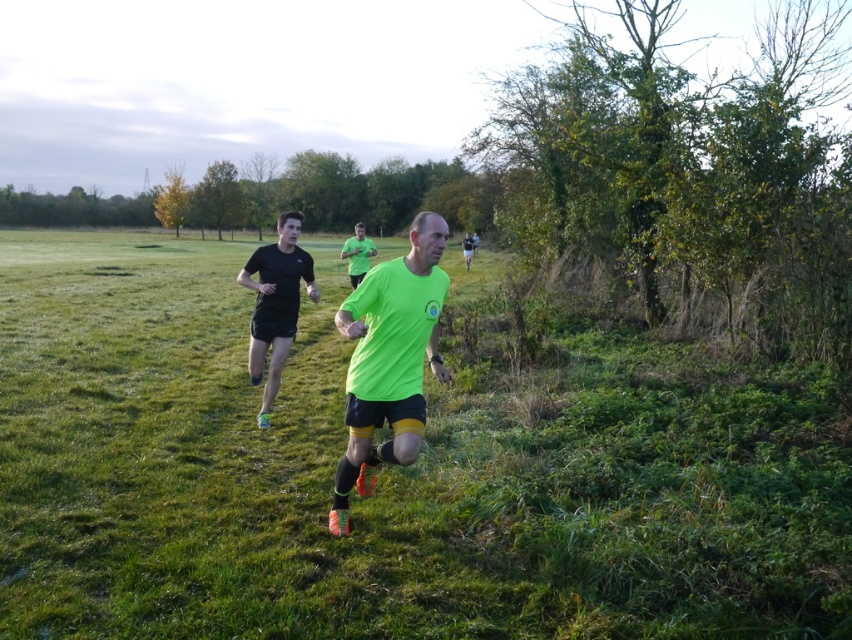
You are a drone operator trying to capture a photo of the runners in the image. The camera is currently focused on the green grass at center. To adjust the focus to the runners, should you move the camera upwards or downwards? Please explain your reasoning based on the scene description.

The green grass at center is located at point (389,472) in 2D coordinates. Since the runners are in the foreground and the grass is at the center, moving the camera upwards would bring the runners into focus as they are likely positioned lower in the frame compared to the central grass area.